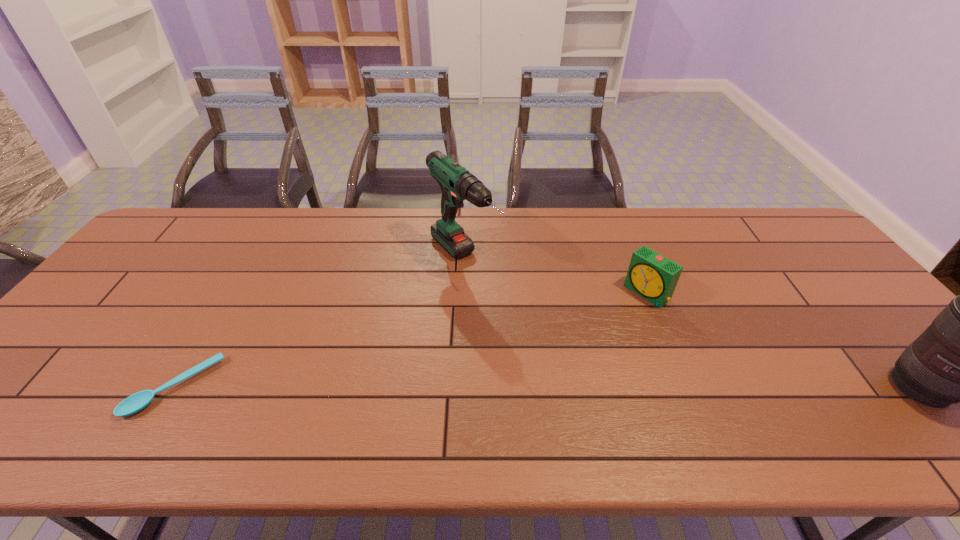
Locate an element on the screen. free spot on the desktop that is between the leftmost object and the second tallest object and is positioned on the handle side of the tallest object is located at coordinates (595, 387).

The image size is (960, 540). Find the location of `free space on the desktop that is between the spoon and the second tallest object and is positioned on the front-facing side of the third tallest object`. free space on the desktop that is between the spoon and the second tallest object and is positioned on the front-facing side of the third tallest object is located at coordinates (523, 387).